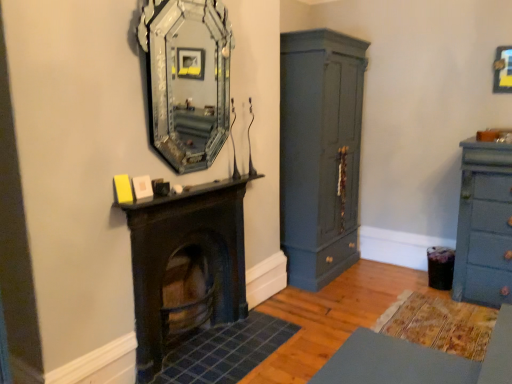
Question: Looking at the image, does silver mirrored frame at upper center seem bigger or smaller compared to metallic gold picture frame at upper right?

Choices:
 (A) small
 (B) big

Answer: (B)

Question: Is silver mirrored frame at upper center inside or outside of metallic gold picture frame at upper right?

Choices:
 (A) outside
 (B) inside

Answer: (A)

Question: Estimate the real-world distances between objects in this image. Which object is farther from the silver mirrored frame at upper center?

Choices:
 (A) metallic gold picture frame at upper right
 (B) dark wood fireplace at center
 (C) matte dark blue cupboard at center right
 (D) matte blue dresser at right

Answer: (A)

Question: Which of these objects is positioned farthest from the matte blue dresser at right?

Choices:
 (A) matte dark blue cupboard at center right
 (B) metallic gold picture frame at upper right
 (C) dark wood fireplace at center
 (D) silver mirrored frame at upper center

Answer: (D)